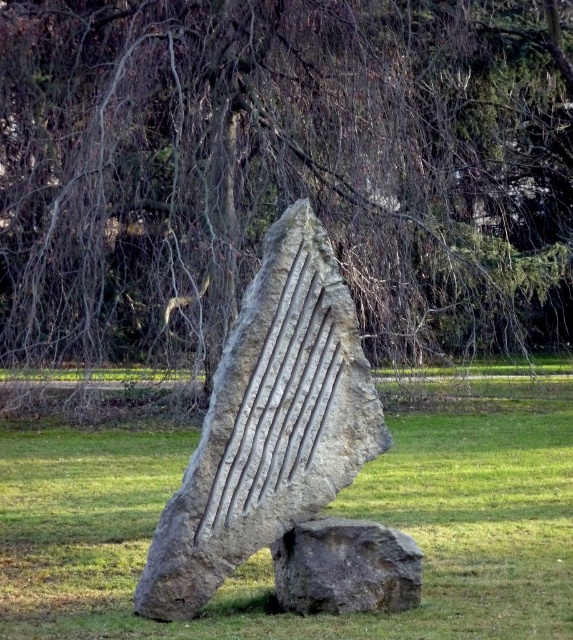
Is bare branches at center wider than gray stone sculpture at center?

No, bare branches at center is not wider than gray stone sculpture at center.

At what (x,y) coordinates should I click in order to perform the action: click on bare branches at center. Please return your answer as a coordinate pair (x, y). The width and height of the screenshot is (573, 640). Looking at the image, I should click on (282, 172).

The width and height of the screenshot is (573, 640). I want to click on bare branches at center, so click(282, 172).

Does bare branches at center appear over natural stone sculpture at center?

Yes, bare branches at center is above natural stone sculpture at center.

Does bare branches at center appear on the left side of natural stone sculpture at center?

No, bare branches at center is not to the left of natural stone sculpture at center.

Between point (60, 321) and point (500, 467), which one is positioned in front?

Point (500, 467) is in front.

Identify the location of bare branches at center. Image resolution: width=573 pixels, height=640 pixels. (282, 172).

Identify the location of gray stone sculpture at center. (268, 422).

Is gray stone sculpture at center above gray rough rock at lower center?

Yes.

The width and height of the screenshot is (573, 640). What are the coordinates of `gray stone sculpture at center` in the screenshot? It's located at (268, 422).

Where is `gray stone sculpture at center`? This screenshot has width=573, height=640. gray stone sculpture at center is located at coordinates (268, 422).